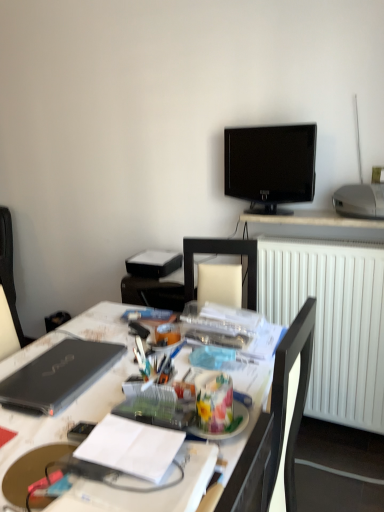
Question: Are dark gray fabric computer chair at left and black glossy tv at upper center far apart?

Choices:
 (A) no
 (B) yes

Answer: (B)

Question: From a real-world perspective, is dark gray fabric computer chair at left physically below black glossy tv at upper center?

Choices:
 (A) no
 (B) yes

Answer: (B)

Question: Is dark gray fabric computer chair at left oriented towards black glossy tv at upper center?

Choices:
 (A) no
 (B) yes

Answer: (A)

Question: Is the position of dark gray fabric computer chair at left less distant than that of black glossy tv at upper center?

Choices:
 (A) no
 (B) yes

Answer: (A)

Question: From the image's perspective, does dark gray fabric computer chair at left appear lower than black glossy tv at upper center?

Choices:
 (A) yes
 (B) no

Answer: (A)

Question: Relative to translucent plastic container at center, is silver metallic projector at upper right in front or behind?

Choices:
 (A) behind
 (B) front

Answer: (A)

Question: Is silver metallic projector at upper right inside or outside of translucent plastic container at center?

Choices:
 (A) outside
 (B) inside

Answer: (A)

Question: From the image's perspective, relative to translucent plastic container at center, is silver metallic projector at upper right above or below?

Choices:
 (A) below
 (B) above

Answer: (B)

Question: Considering the relative positions of silver metallic projector at upper right and translucent plastic container at center in the image provided, is silver metallic projector at upper right to the left or to the right of translucent plastic container at center?

Choices:
 (A) left
 (B) right

Answer: (B)

Question: Is translucent plastic container at center to the left or to the right of white paper notebook at center in the image?

Choices:
 (A) right
 (B) left

Answer: (A)

Question: From their relative heights in the image, would you say translucent plastic container at center is taller or shorter than white paper notebook at center?

Choices:
 (A) tall
 (B) short

Answer: (A)

Question: In the image, is translucent plastic container at center positioned in front of or behind white paper notebook at center?

Choices:
 (A) behind
 (B) front

Answer: (A)

Question: From a real-world perspective, is translucent plastic container at center positioned above or below white paper notebook at center?

Choices:
 (A) above
 (B) below

Answer: (A)

Question: From a real-world perspective, is translucent plastic container at center positioned above or below black matte laptop at left?

Choices:
 (A) above
 (B) below

Answer: (A)

Question: Is translucent plastic container at center taller or shorter than black matte laptop at left?

Choices:
 (A) short
 (B) tall

Answer: (B)